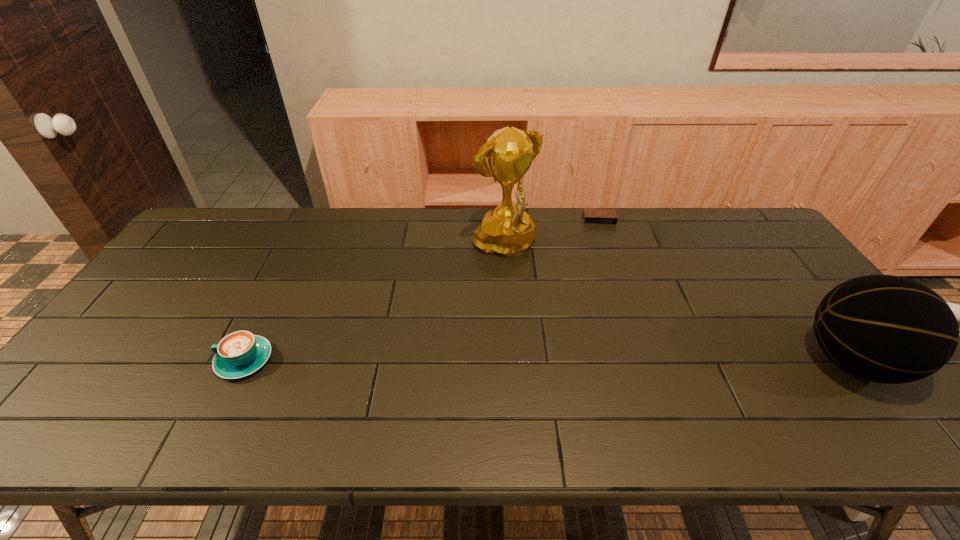
The image size is (960, 540). I want to click on vacant region located 0.110m with the handle on the right side of the cappuccino, so [x=174, y=360].

Where is `vacant position located 0.170m on the left of the rightmost object`? The width and height of the screenshot is (960, 540). vacant position located 0.170m on the left of the rightmost object is located at coordinates [x=733, y=362].

Where is `vacant space located 0.170m on the front side of the tallest object`? Image resolution: width=960 pixels, height=540 pixels. vacant space located 0.170m on the front side of the tallest object is located at coordinates (564, 302).

You are a GUI agent. You are given a task and a screenshot of the screen. Output one action in this format:
    pyautogui.click(x=<x>, y=<y>)
    Task: Click on the blank space located on the front side of the tallest object
    The height and width of the screenshot is (540, 960).
    Given the screenshot: What is the action you would take?
    pyautogui.click(x=595, y=329)

Where is `vacant space situated 0.150m on the front side of the tallest object`? The image size is (960, 540). vacant space situated 0.150m on the front side of the tallest object is located at coordinates (560, 298).

At what (x,y) coordinates should I click in order to perform the action: click on free space located on the front face of the third object from left to right. Please return your answer as a coordinate pair (x, y). This screenshot has height=540, width=960. Looking at the image, I should click on (612, 275).

The height and width of the screenshot is (540, 960). I want to click on vacant space located on the front face of the third object from left to right, so click(x=606, y=250).

Locate an element on the screen. free space located on the front face of the third object from left to right is located at coordinates (605, 246).

Where is `award that is at the far edge`? The image size is (960, 540). award that is at the far edge is located at coordinates (508, 230).

In order to click on alarm clock at the far edge in this screenshot , I will do `click(590, 215)`.